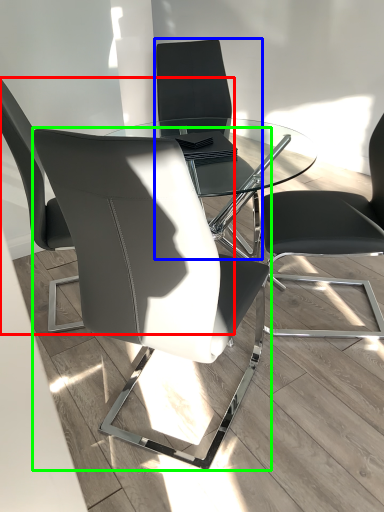
Question: Which object is positioned closest to chair (highlighted by a red box)? Select from chair (highlighted by a blue box) and chair (highlighted by a green box).

Choices:
 (A) chair
 (B) chair

Answer: (B)